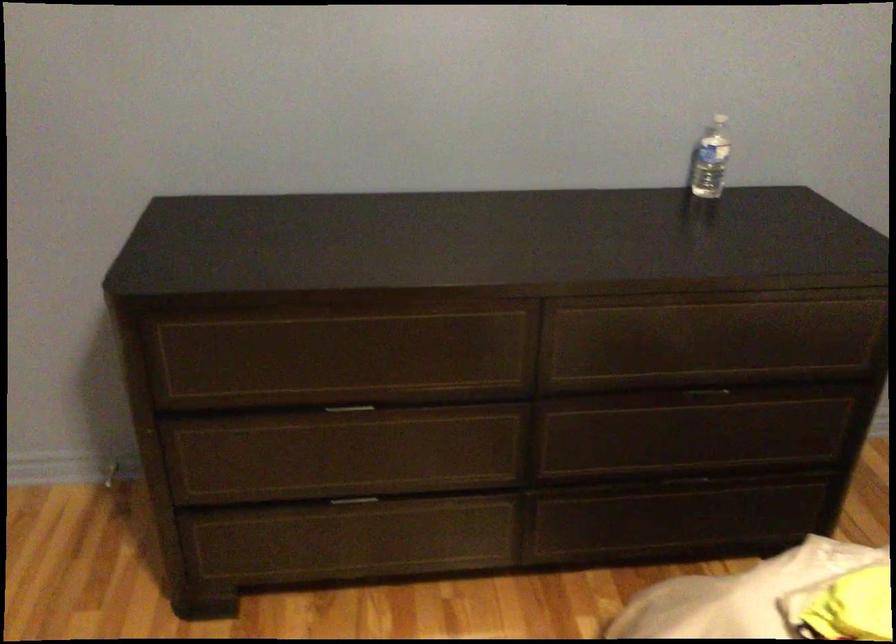
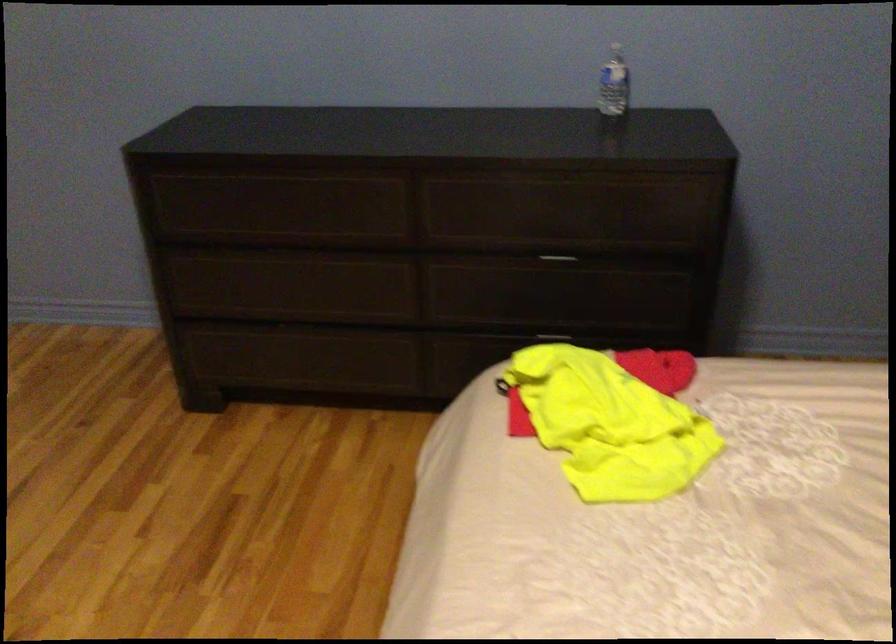
Find the pixel in the second image that matches (x=719, y=165) in the first image.

(614, 84)